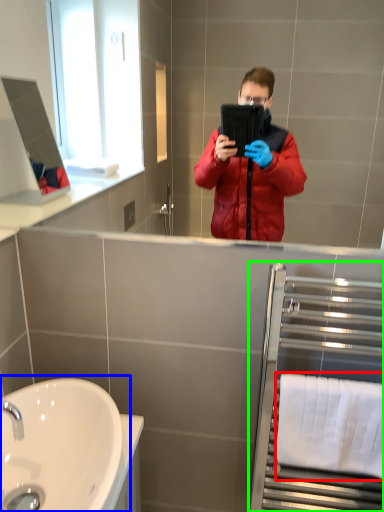
Question: Which object is positioned farthest from towel bar (highlighted by a red box)? Select from sink (highlighted by a blue box) and balustrade (highlighted by a green box).

Choices:
 (A) sink
 (B) balustrade

Answer: (A)